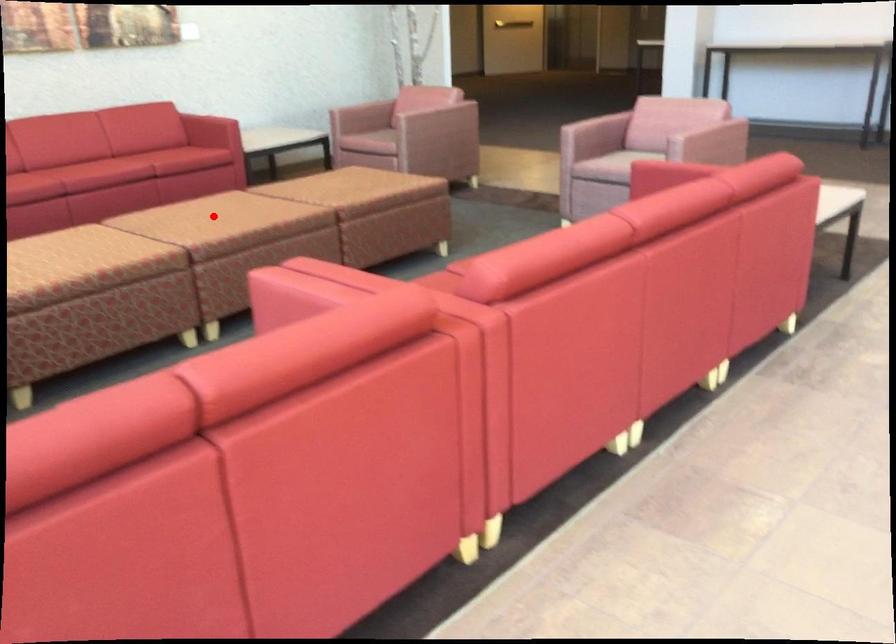
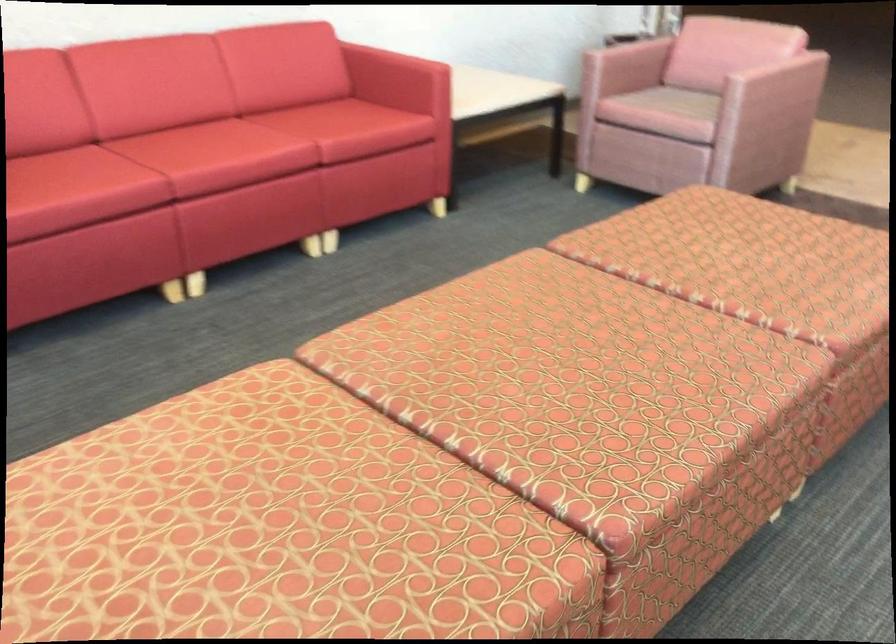
Where in the second image is the point corresponding to the highlighted location from the first image?

(549, 377)